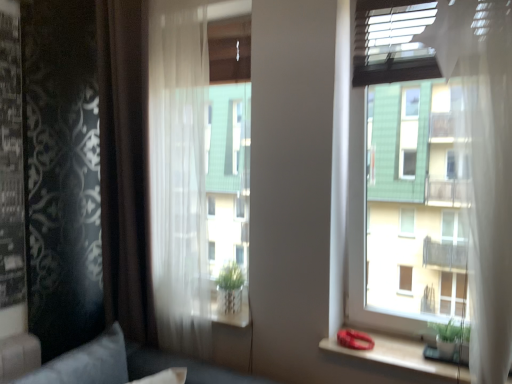
This screenshot has width=512, height=384. What do you see at coordinates (400, 356) in the screenshot?
I see `wooden at right` at bounding box center [400, 356].

The height and width of the screenshot is (384, 512). What do you see at coordinates (179, 174) in the screenshot?
I see `sheer white curtain at center, the second curtain when ordered from left to right` at bounding box center [179, 174].

Identify the location of brown sheer curtain at left, which is the 2th curtain from right to left. (125, 166).

Between sheer white curtain at center, the second curtain when ordered from left to right, and velvet gray pillow at lower left, which one has smaller width?

sheer white curtain at center, the second curtain when ordered from left to right, is thinner.

In the scene shown: Choose the correct answer: Is sheer white curtain at center, the 1th curtain when ordered from right to left, inside velvet gray pillow at lower left or outside it?

The correct answer is: outside.

Which is farther from the camera, [174,97] or [22,380]?

The point [174,97] is farther from the camera.

The width and height of the screenshot is (512, 384). I want to click on curtain that is the 1st object above the velvet gray pillow at lower left (from a real-world perspective), so click(x=179, y=174).

From a real-world perspective, between transparent glass window at upper right and velvet gray pillow at lower left, who is vertically higher?

transparent glass window at upper right, from a real-world perspective.

Considering the positions of points (474, 134) and (114, 348), is point (474, 134) farther from camera compared to point (114, 348)?

That is False.

Which of these two, transparent glass window at upper right or velvet gray pillow at lower left, stands shorter?

velvet gray pillow at lower left is shorter.

Is velvet gray pillow at lower left aimed at brown sheer curtain at left, positioned as the 1th curtain in left-to-right order?

No, velvet gray pillow at lower left does not turn towards brown sheer curtain at left, positioned as the 1th curtain in left-to-right order.

Find the location of a particular element. The image size is (512, 384). the 1st curtain to the right of the velvet gray pillow at lower left, counting from the anchor's position is located at coordinates (125, 166).

Is velvet gray pillow at lower left next to brown sheer curtain at left, which is the 2th curtain from right to left?

No, velvet gray pillow at lower left is not with brown sheer curtain at left, which is the 2th curtain from right to left.

Can you tell me how much velvet gray pillow at lower left and brown sheer curtain at left, which is the 2th curtain from right to left, differ in facing direction?

89 degrees.

Is wooden at right in contact with transparent glass window at upper right?

No, wooden at right is not next to transparent glass window at upper right.

Which object is closer to the camera taking this photo, wooden at right or transparent glass window at upper right?

transparent glass window at upper right is closer to the camera.

Locate an element on the screen. The width and height of the screenshot is (512, 384). window located above the wooden at right (from a real-world perspective) is located at coordinates (482, 165).

From a real-world perspective, who is located lower, wooden at right or transparent glass window at upper right?

wooden at right, from a real-world perspective.

Between brown sheer curtain at left, positioned as the 1th curtain in left-to-right order, and transparent glass window at upper right, which one has smaller size?

brown sheer curtain at left, positioned as the 1th curtain in left-to-right order, is smaller.

Does point (139, 22) lie behind point (466, 58)?

Yes, it is behind point (466, 58).

Is brown sheer curtain at left, positioned as the 1th curtain in left-to-right order, positioned far away from transparent glass window at upper right?

Indeed, brown sheer curtain at left, positioned as the 1th curtain in left-to-right order, is not near transparent glass window at upper right.

From the picture: Could you measure the distance between brown sheer curtain at left, positioned as the 1th curtain in left-to-right order, and transparent glass window at upper right?

brown sheer curtain at left, positioned as the 1th curtain in left-to-right order, is 1.56 meters from transparent glass window at upper right.

How far apart are wooden at right and velvet gray pillow at lower left?

They are 1.09 meters apart.

Is velvet gray pillow at lower left inside wooden at right?

No, velvet gray pillow at lower left is located outside of wooden at right.

Which point is more forward, [348,354] or [98,344]?

The point [348,354] is closer to the camera.

Can you confirm if wooden at right is shorter than velvet gray pillow at lower left?

Indeed, wooden at right has a lesser height compared to velvet gray pillow at lower left.

You are a GUI agent. You are given a task and a screenshot of the screen. Output one action in this format:
    pyautogui.click(x=<x>, y=<y>)
    Task: Click on the 2nd curtain behind the wooden at right, counting from the anchor's position
    
    Given the screenshot: What is the action you would take?
    pyautogui.click(x=125, y=166)

Based on their sizes in the image, would you say wooden at right is bigger or smaller than brown sheer curtain at left, positioned as the 1th curtain in left-to-right order?

Considering their sizes, wooden at right takes up less space than brown sheer curtain at left, positioned as the 1th curtain in left-to-right order.

Is wooden at right completely or partially outside of brown sheer curtain at left, which is the 2th curtain from right to left?

Yes.

This screenshot has width=512, height=384. In the image, there is a sheer white curtain at center, the 1th curtain when ordered from right to left. In order to click on pillow below it (from a real-world perspective) in this screenshot , I will do `click(86, 363)`.

Locate an element on the screen. Image resolution: width=512 pixels, height=384 pixels. window behind the velvet gray pillow at lower left is located at coordinates (482, 165).

Which object lies further to the anchor point brown sheer curtain at left, which is the 2th curtain from right to left, sheer white curtain at center, the 1th curtain when ordered from right to left, or velvet gray pillow at lower left?

Among the two, velvet gray pillow at lower left is located further to brown sheer curtain at left, which is the 2th curtain from right to left.

From the picture: When comparing their distances from transparent glass window at upper right, does brown sheer curtain at left, positioned as the 1th curtain in left-to-right order, or sheer white curtain at center, the second curtain when ordered from left to right, seem further?

Among the two, brown sheer curtain at left, positioned as the 1th curtain in left-to-right order, is located further to transparent glass window at upper right.

Considering their positions, is wooden at right positioned further to transparent glass window at upper right than sheer white curtain at center, the second curtain when ordered from left to right?

Based on the image, sheer white curtain at center, the second curtain when ordered from left to right, appears to be further to transparent glass window at upper right.

From the image, which object appears to be nearer to brown sheer curtain at left, which is the 2th curtain from right to left, wooden at right or sheer white curtain at center, the second curtain when ordered from left to right?

Based on the image, sheer white curtain at center, the second curtain when ordered from left to right, appears to be nearer to brown sheer curtain at left, which is the 2th curtain from right to left.

Considering their positions, is transparent glass window at upper right positioned closer to velvet gray pillow at lower left than brown sheer curtain at left, which is the 2th curtain from right to left?

brown sheer curtain at left, which is the 2th curtain from right to left, is positioned closer to the anchor velvet gray pillow at lower left.

When comparing their distances from wooden at right, does brown sheer curtain at left, positioned as the 1th curtain in left-to-right order, or velvet gray pillow at lower left seem closer?

velvet gray pillow at lower left.

Based on their spatial positions, is wooden at right or transparent glass window at upper right further from sheer white curtain at center, the second curtain when ordered from left to right?

transparent glass window at upper right is further to sheer white curtain at center, the second curtain when ordered from left to right.

Estimate the real-world distances between objects in this image. Which object is further from sheer white curtain at center, the 1th curtain when ordered from right to left, transparent glass window at upper right or velvet gray pillow at lower left?

Among the two, transparent glass window at upper right is located further to sheer white curtain at center, the 1th curtain when ordered from right to left.

Locate an element on the screen. curtain situated between brown sheer curtain at left, which is the 2th curtain from right to left, and transparent glass window at upper right from left to right is located at coordinates (179, 174).

At what (x,y) coordinates should I click in order to perform the action: click on window sill between brown sheer curtain at left, which is the 2th curtain from right to left, and transparent glass window at upper right. Please return your answer as a coordinate pair (x, y). The height and width of the screenshot is (384, 512). Looking at the image, I should click on (400, 356).

Where is `window sill situated between sheer white curtain at center, the second curtain when ordered from left to right, and transparent glass window at upper right from left to right`? The image size is (512, 384). window sill situated between sheer white curtain at center, the second curtain when ordered from left to right, and transparent glass window at upper right from left to right is located at coordinates (400, 356).

The height and width of the screenshot is (384, 512). I want to click on window sill located between velvet gray pillow at lower left and transparent glass window at upper right in the left-right direction, so (400, 356).